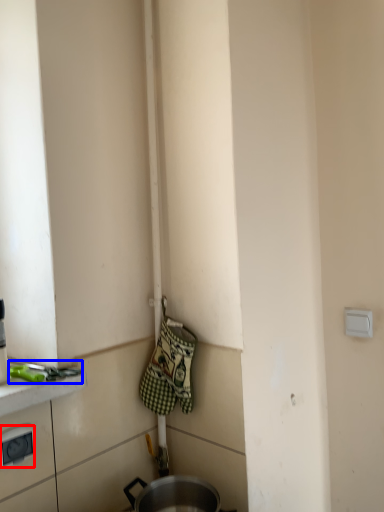
Question: Which of the following is the closest to the observer, electric outlet (highlighted by a red box) or tool (highlighted by a blue box)?

Choices:
 (A) electric outlet
 (B) tool

Answer: (A)